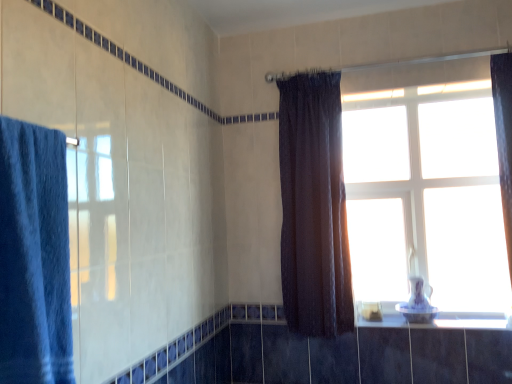
Question: Is dark brown sheer curtain at center, the second curtain viewed from the front, smaller than white glass window at upper right?

Choices:
 (A) yes
 (B) no

Answer: (B)

Question: Is there a large distance between dark brown sheer curtain at center, the second curtain viewed from the front, and white glass window at upper right?

Choices:
 (A) no
 (B) yes

Answer: (A)

Question: From a real-world perspective, is dark brown sheer curtain at center, the 2th curtain positioned from the left, on white glass window at upper right?

Choices:
 (A) yes
 (B) no

Answer: (A)

Question: Can you confirm if dark brown sheer curtain at center, the second curtain viewed from the front, is wider than white glass window at upper right?

Choices:
 (A) no
 (B) yes

Answer: (B)

Question: Is dark brown sheer curtain at center, the second curtain viewed from the front, placed right next to white glass window at upper right?

Choices:
 (A) no
 (B) yes

Answer: (A)

Question: Does dark brown sheer curtain at center, which is the 1th curtain from back to front, have a lesser width compared to white glass window at upper right?

Choices:
 (A) no
 (B) yes

Answer: (A)

Question: Is white glossy window sill at lower right facing towards dark brown sheer curtain at center, the second curtain viewed from the front?

Choices:
 (A) yes
 (B) no

Answer: (B)

Question: Considering the relative positions of white glossy window sill at lower right and dark brown sheer curtain at center, the 2th curtain positioned from the left, in the image provided, is white glossy window sill at lower right to the right of dark brown sheer curtain at center, the 2th curtain positioned from the left, from the viewer's perspective?

Choices:
 (A) no
 (B) yes

Answer: (B)

Question: Can you confirm if white glossy window sill at lower right is positioned to the left of dark brown sheer curtain at center, which is the 1th curtain from back to front?

Choices:
 (A) yes
 (B) no

Answer: (B)

Question: Is white glossy window sill at lower right turned away from dark brown sheer curtain at center, which is the 1th curtain from back to front?

Choices:
 (A) yes
 (B) no

Answer: (B)

Question: From a real-world perspective, is white glossy window sill at lower right positioned under dark brown sheer curtain at center, acting as the 1th curtain starting from the right, based on gravity?

Choices:
 (A) no
 (B) yes

Answer: (B)

Question: Is white glossy window sill at lower right far from dark brown sheer curtain at center, which is the 1th curtain from back to front?

Choices:
 (A) no
 (B) yes

Answer: (A)

Question: Can white glossy window sill at lower right be found inside blue fabric towel at left, which is the 1th curtain from left to right?

Choices:
 (A) yes
 (B) no

Answer: (B)